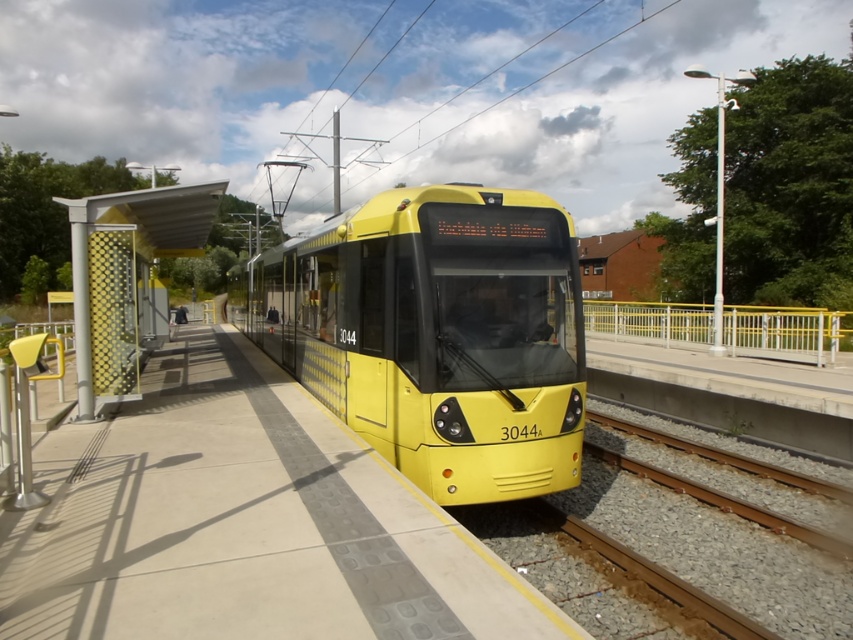
You are a passenger waiting on the platform. You notice the smooth concrete platform at center and the yellow matte train at center. Which object is closer to the ground?

The smooth concrete platform at center is located below the yellow matte train at center, so it is closer to the ground.

You are standing on the platform at the tram station. You want to move to the exact location of the point labeled as point (242, 524). Where should you go on the platform?

The point (242, 524) corresponds to the smooth concrete platform at center, so you should go to the smooth concrete platform at center to reach that point.

You are standing on the platform and want to walk from point (178, 544) to point (86, 237). Which direction should you move to get closer to the tram?

You should move towards the tram by moving forward since point (178, 544) is closer to the viewer than point (86, 237), meaning the latter is further away from you and closer to the tram.